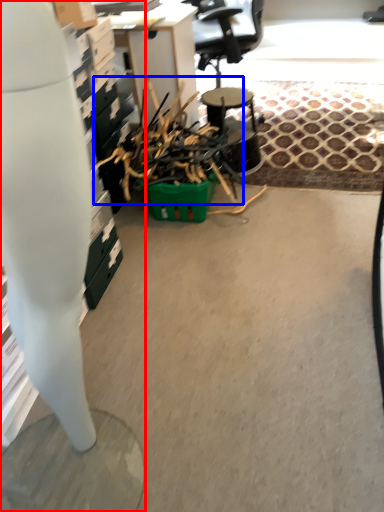
Question: Which object is closer to the camera taking this photo, desk (highlighted by a red box) or debris (highlighted by a blue box)?

Choices:
 (A) desk
 (B) debris

Answer: (A)